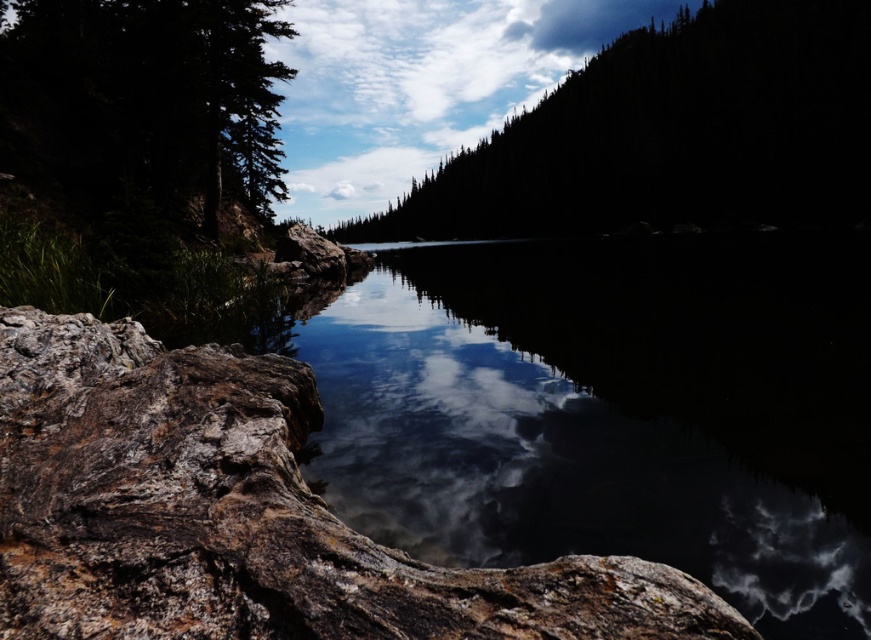
How far apart are green textured trees at upper center and green matte tree at upper left?

The distance of green textured trees at upper center from green matte tree at upper left is 100.06 meters.

Does green textured trees at upper center have a greater width compared to green matte tree at upper left?

Yes.

The image size is (871, 640). In order to click on green textured trees at upper center in this screenshot , I will do `click(672, 132)`.

Measure the distance between transparent glass water at center and green matte tree at upper left.

The distance of transparent glass water at center from green matte tree at upper left is 64.68 feet.

Which is behind, point (512, 448) or point (163, 0)?

Positioned behind is point (163, 0).

Where is `transparent glass water at center`? The width and height of the screenshot is (871, 640). transparent glass water at center is located at coordinates (610, 412).

Does transparent glass water at center have a lesser width compared to green textured trees at upper center?

Correct, transparent glass water at center's width is less than green textured trees at upper center's.

Where is `transparent glass water at center`? transparent glass water at center is located at coordinates (610, 412).